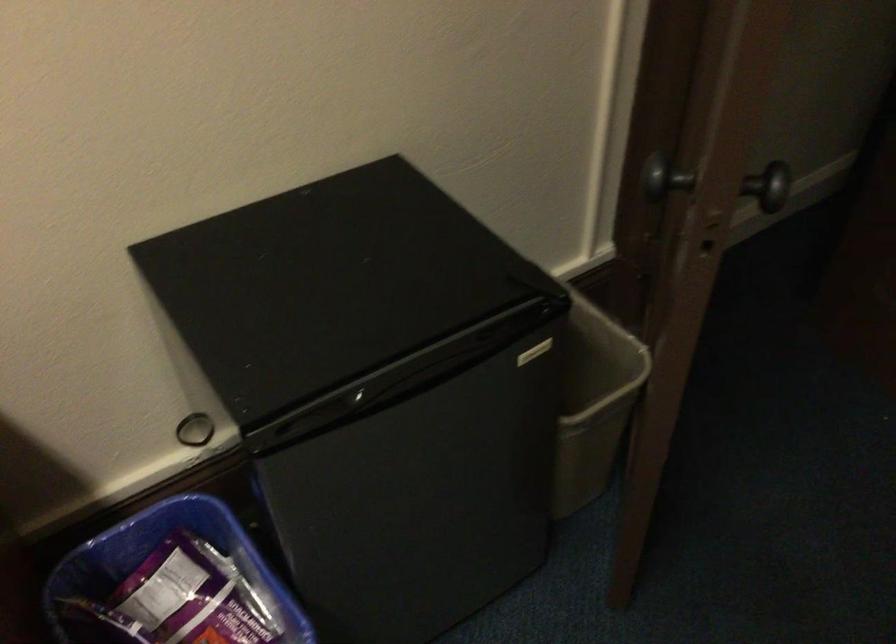
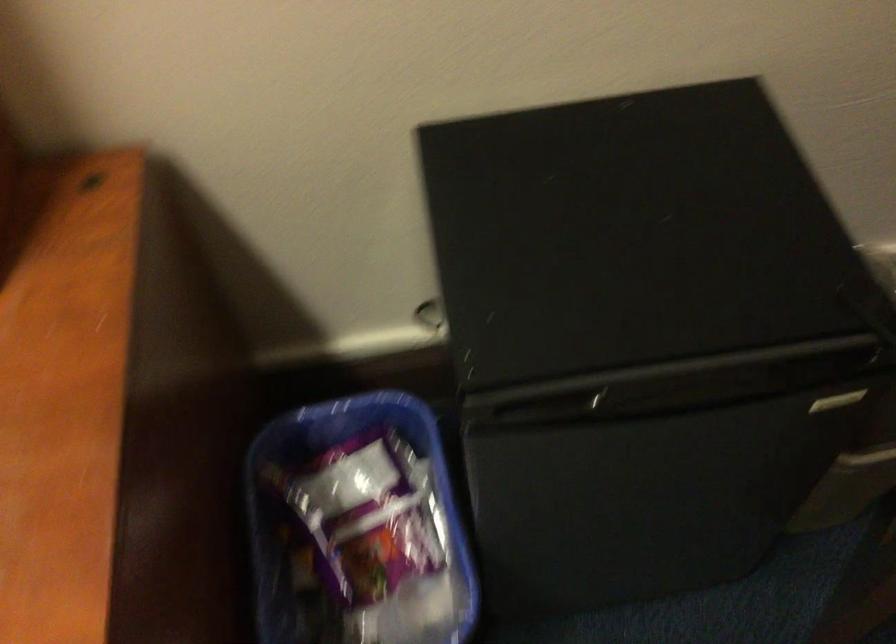
Question: What movement of the cameraman would produce the second image?

Choices:
 (A) Left
 (B) Right
 (C) Forward
 (D) Backward

Answer: (C)